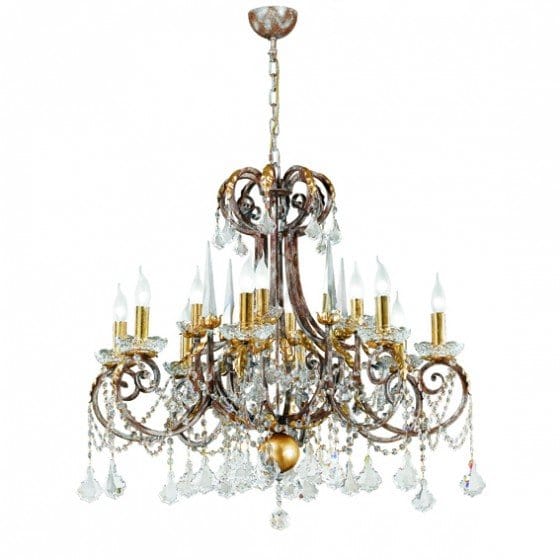
At what (x,y) coordinates should I click in order to perform the action: click on flame shaped lights. Please return your answer as a coordinate pair (x, y). This screenshot has width=560, height=560. Looking at the image, I should click on (438, 302), (395, 310), (385, 281), (357, 291), (261, 274), (242, 283), (197, 290), (135, 293), (125, 308).